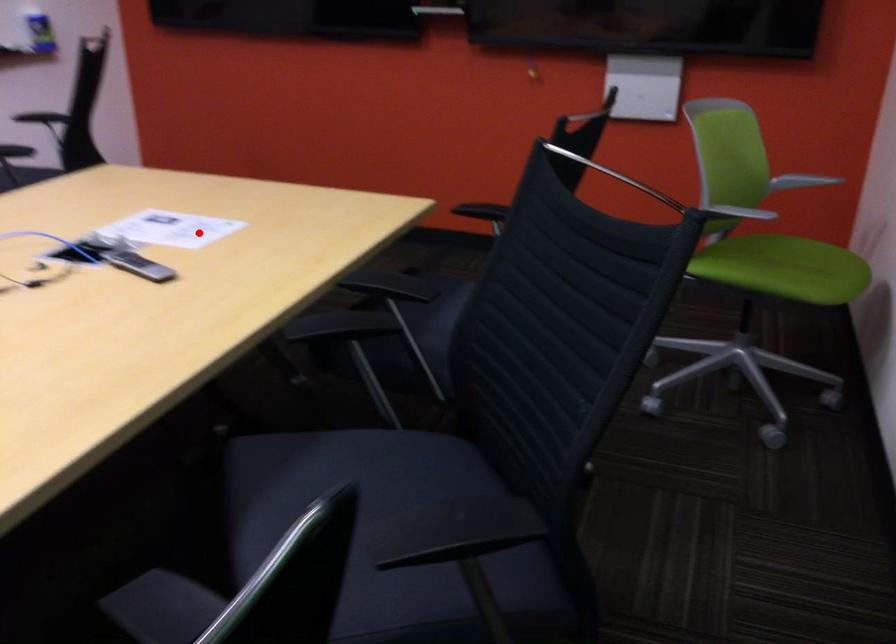
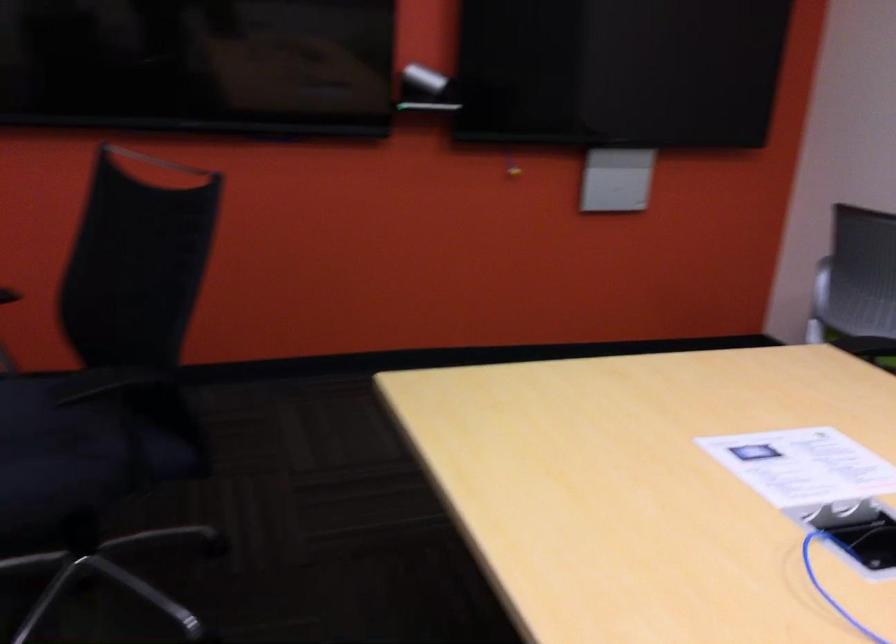
The point at the highlighted location is marked in the first image. Where is the corresponding point in the second image?

(803, 466)